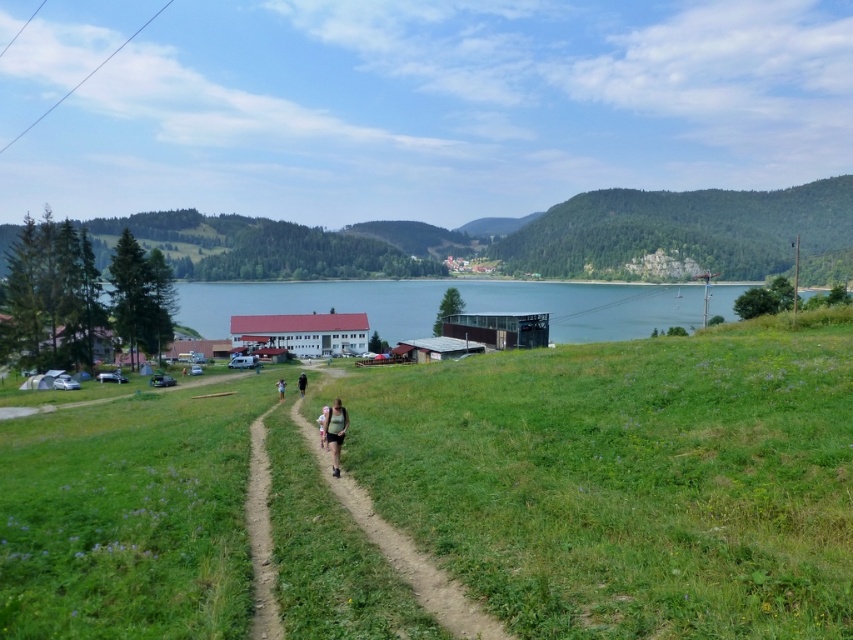
You are standing on the brown dirt path at center and want to reach the green grassy field at center. In which direction should you move?

You should move to the right to reach the green grassy field at center since it is located to the right of the brown dirt path at center.

You are a hiker planning to walk from the dirt path to the green forested hillside at upper right. Which direction should you head to reach the hillside from the green grassy field at center?

The green forested hillside at upper right is taller than the green grassy field at center, so you should head towards the upper right direction to reach the hillside from the green grassy field at center.

You are planning to set up a tent in the green grassy field at center and the green forested hillside at upper right. Based on their widths, which location would allow for a larger tent setup?

The green forested hillside at upper right has a greater width than the green grassy field at center, so it can accommodate a larger tent setup.